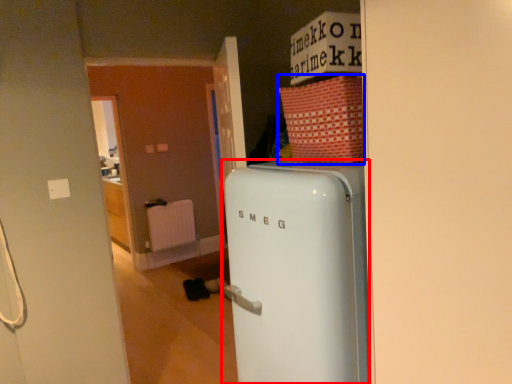
Question: Which object appears farthest to the camera in this image, refrigerator (highlighted by a red box) or cardboard box (highlighted by a blue box)?

Choices:
 (A) refrigerator
 (B) cardboard box

Answer: (B)